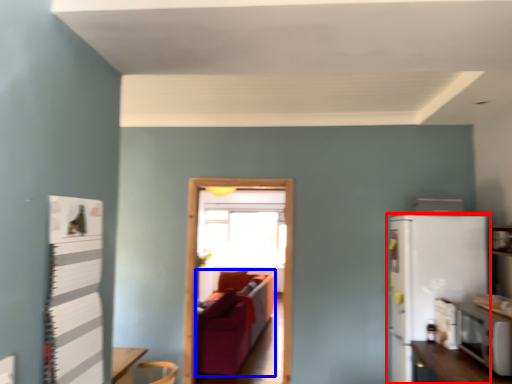
Question: Which of the following is the closest to the observer, refrigerator (highlighted by a red box) or couch (highlighted by a blue box)?

Choices:
 (A) refrigerator
 (B) couch

Answer: (A)